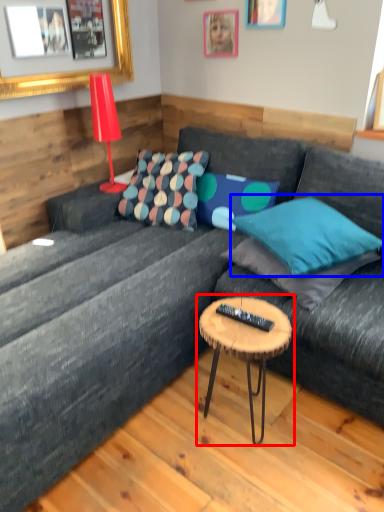
Question: Which object appears farthest to the camera in this image, coffee table (highlighted by a red box) or pillow (highlighted by a blue box)?

Choices:
 (A) coffee table
 (B) pillow

Answer: (B)